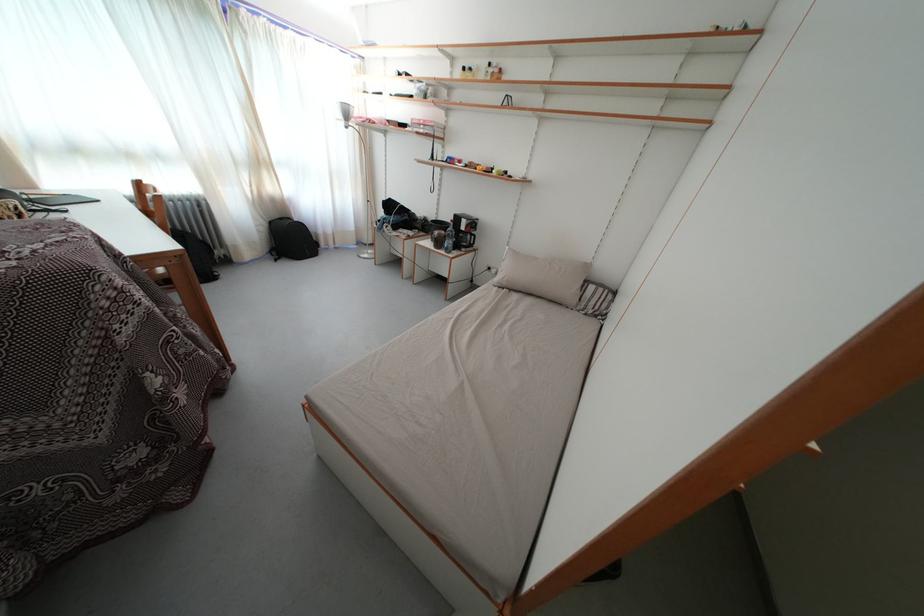
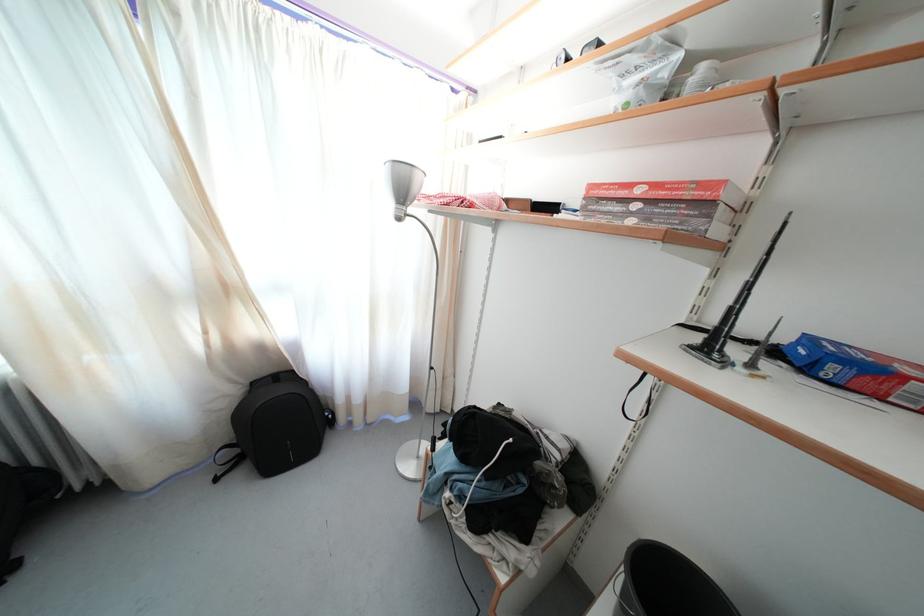
Find the pixel in the second image that matches the point at 353,122 in the first image.

(408, 199)